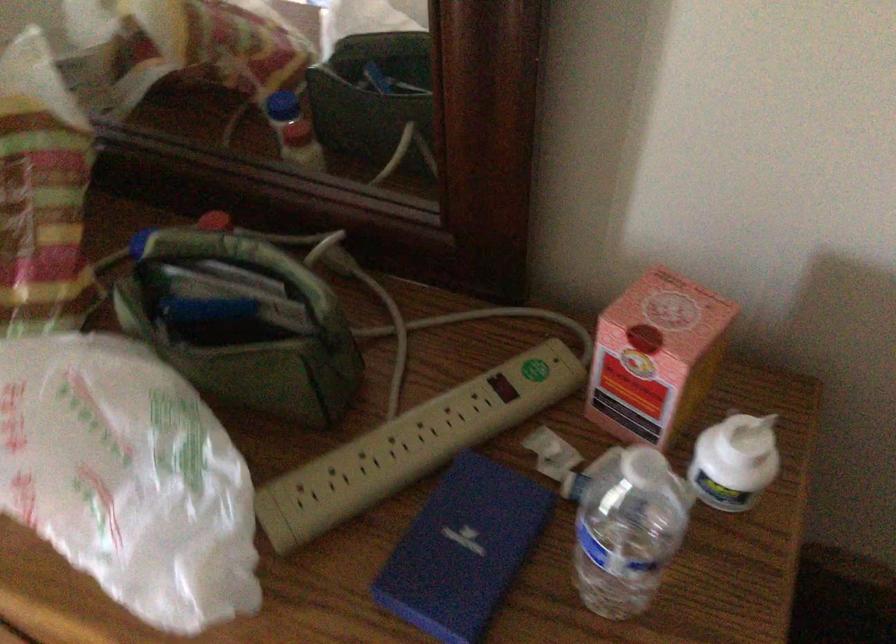
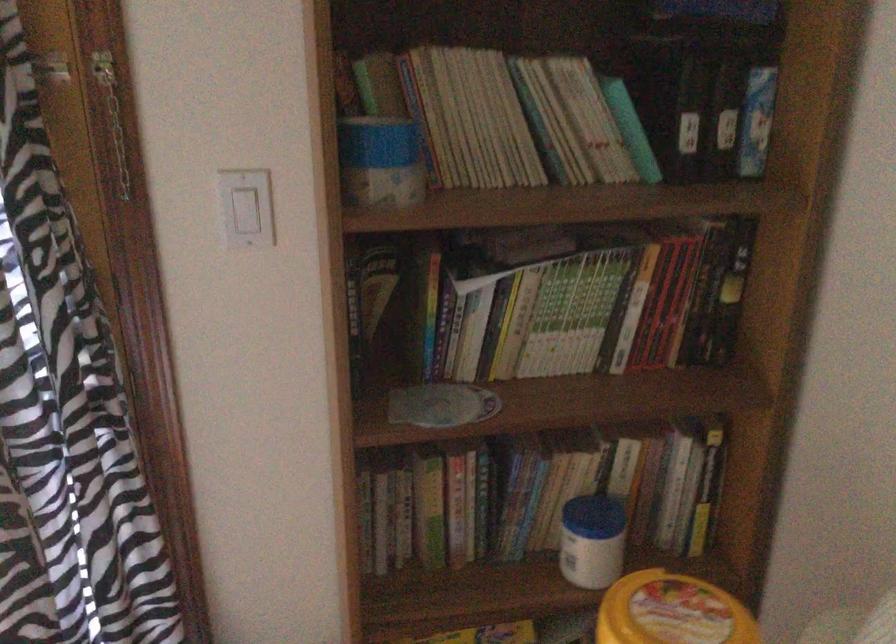
Question: The camera is either moving clockwise (left) or counter-clockwise (right) around the object. The first image is from the beginning of the video and the second image is from the end. Is the camera moving left or right when shooting the video?

Choices:
 (A) Left
 (B) Right

Answer: (B)